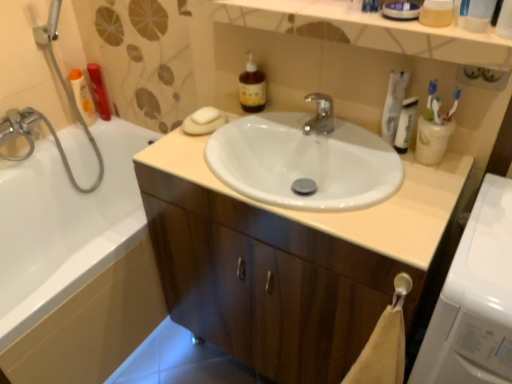
Question: Can you confirm if white matte soap at upper center is positioned to the left of white glossy sink at center?

Choices:
 (A) yes
 (B) no

Answer: (A)

Question: From the image's perspective, would you say white matte soap at upper center is shown under white glossy sink at center?

Choices:
 (A) yes
 (B) no

Answer: (B)

Question: From a real-world perspective, is white matte soap at upper center under white glossy sink at center?

Choices:
 (A) yes
 (B) no

Answer: (B)

Question: Can white glossy sink at center be found inside white matte soap at upper center?

Choices:
 (A) yes
 (B) no

Answer: (B)

Question: Does white matte soap at upper center have a larger size compared to white glossy sink at center?

Choices:
 (A) no
 (B) yes

Answer: (A)

Question: Is white matte soap at upper center smaller than white glossy sink at center?

Choices:
 (A) yes
 (B) no

Answer: (A)

Question: Is white plastic toothbrush at upper right, the 2th toothbrush in the left-to-right sequence, positioned with its back to blue plastic toothbrush at upper right, the first toothbrush from the left?

Choices:
 (A) yes
 (B) no

Answer: (B)

Question: From the image's perspective, would you say white plastic toothbrush at upper right, acting as the first toothbrush starting from the right, is shown under blue plastic toothbrush at upper right, the first toothbrush from the left?

Choices:
 (A) yes
 (B) no

Answer: (A)

Question: Considering the relative positions of white plastic toothbrush at upper right, acting as the first toothbrush starting from the right, and blue plastic toothbrush at upper right, the first toothbrush from the left, in the image provided, is white plastic toothbrush at upper right, acting as the first toothbrush starting from the right, to the left of blue plastic toothbrush at upper right, the first toothbrush from the left, from the viewer's perspective?

Choices:
 (A) yes
 (B) no

Answer: (B)

Question: Is white plastic toothbrush at upper right, acting as the first toothbrush starting from the right, taller than blue plastic toothbrush at upper right, the first toothbrush from the left?

Choices:
 (A) yes
 (B) no

Answer: (A)

Question: Considering the relative positions of white plastic toothbrush at upper right, the 2th toothbrush in the left-to-right sequence, and blue plastic toothbrush at upper right, marked as the second toothbrush in a right-to-left arrangement, in the image provided, is white plastic toothbrush at upper right, the 2th toothbrush in the left-to-right sequence, in front of blue plastic toothbrush at upper right, marked as the second toothbrush in a right-to-left arrangement,?

Choices:
 (A) no
 (B) yes

Answer: (B)

Question: Considering the relative sizes of white plastic toothbrush at upper right, the 2th toothbrush in the left-to-right sequence, and blue plastic toothbrush at upper right, the first toothbrush from the left, in the image provided, is white plastic toothbrush at upper right, the 2th toothbrush in the left-to-right sequence, wider than blue plastic toothbrush at upper right, the first toothbrush from the left,?

Choices:
 (A) no
 (B) yes

Answer: (A)

Question: Is white plastic toothbrush at upper right, acting as the first toothbrush starting from the right, to the right of white matte soap at upper center from the viewer's perspective?

Choices:
 (A) yes
 (B) no

Answer: (A)